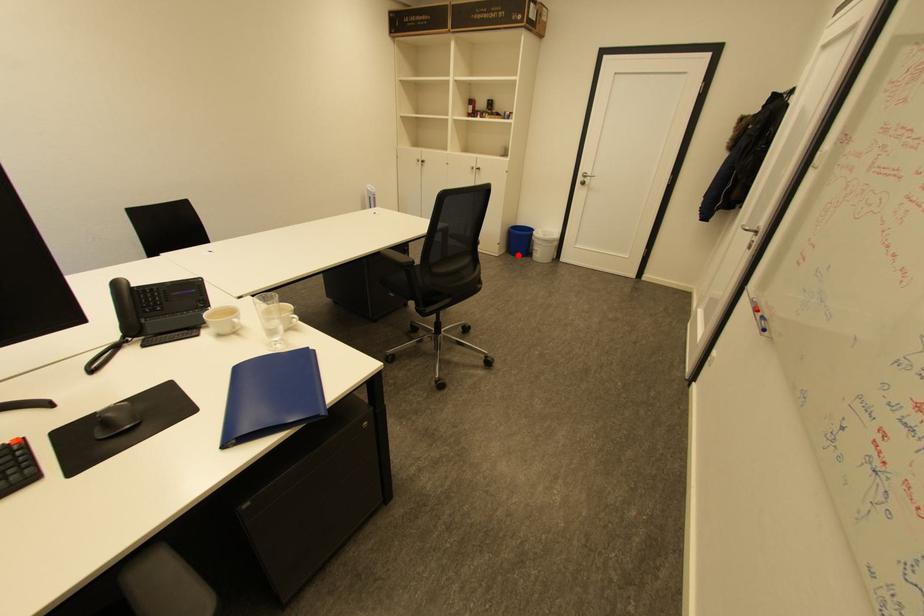
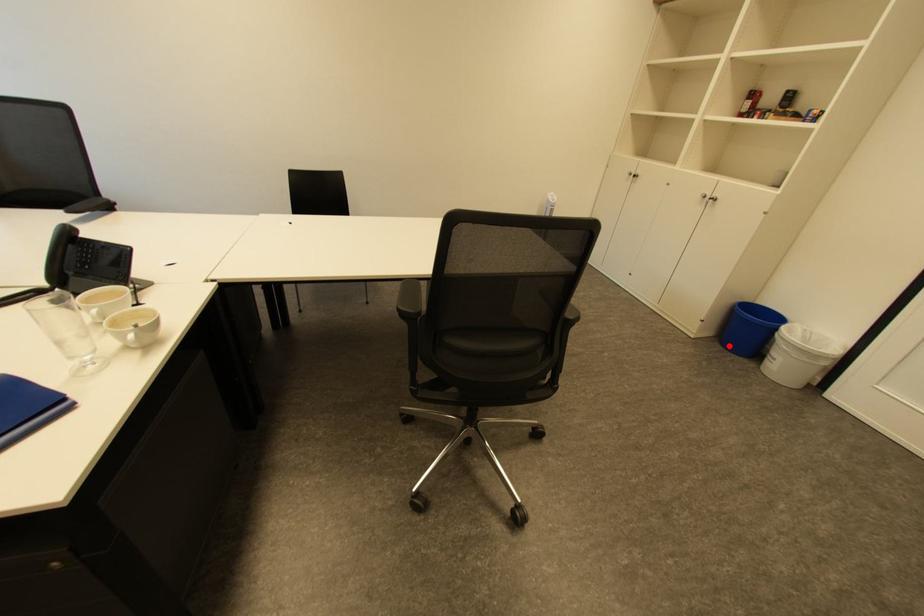
I am providing you with two images of the same scene from different viewpoints. A red point is marked on the first image and another point is marked on the second image. Is the marked point in image1 the same physical position as the marked point in image2?

Yes